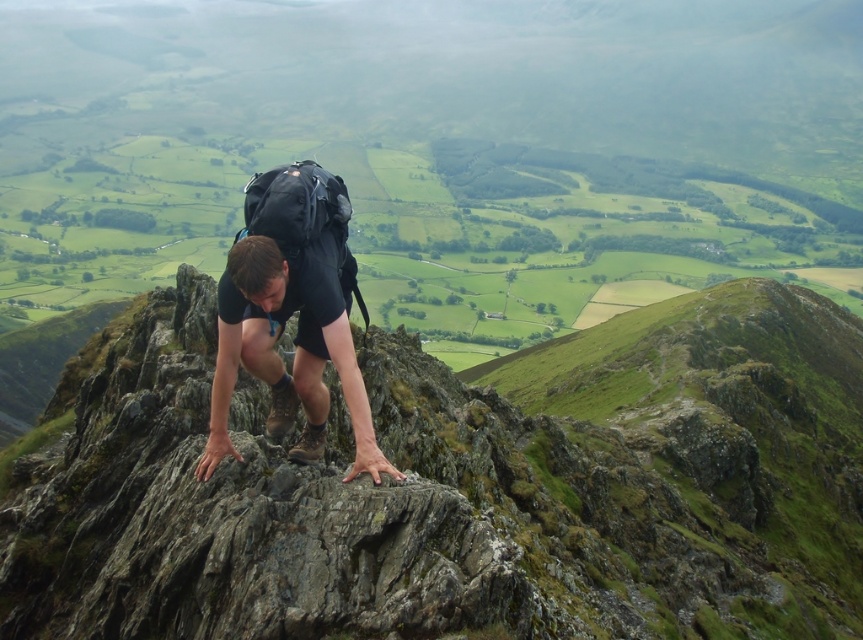
You are a hiker preparing to adjust your gear. You have the black matte shorts at center and the black fabric backpack at center. Which item is smaller in size?

The black matte shorts at center is smaller than the black fabric backpack at center.

You are a hiker looking at the rocky mountain ridge. You notice the black matte shorts at center and the black fabric backpack at center. Which item is positioned to the right of the other?

The black matte shorts at center is to the right of the black fabric backpack at center.